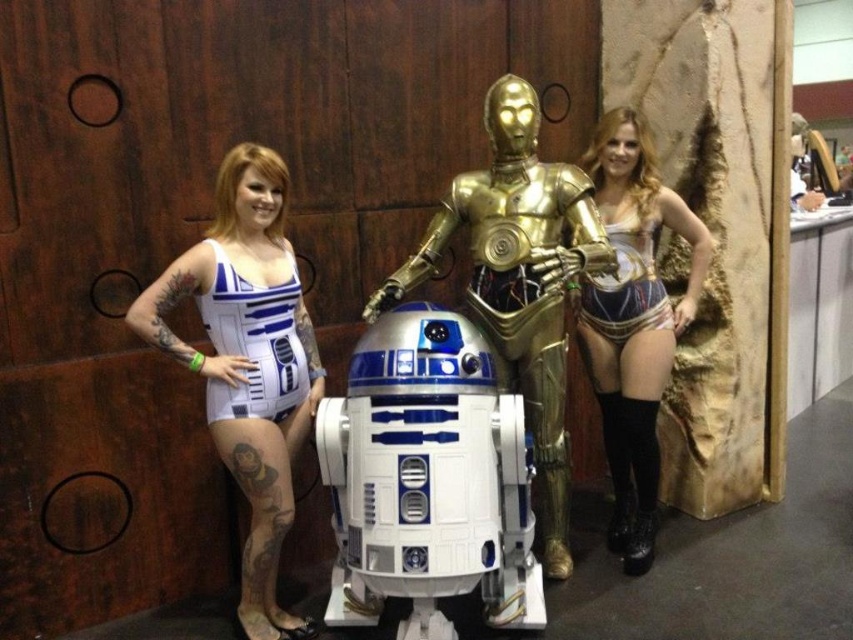
Question: Considering the real-world distances, which object is farthest from the matte gold bikini at center?

Choices:
 (A) white matte swimsuit at left
 (B) white matte bodysuit at left
 (C) metallic gold armor at center
 (D) gold metallic robot at center

Answer: (B)

Question: Does matte gold bikini at center come in front of metallic gold armor at center?

Choices:
 (A) no
 (B) yes

Answer: (B)

Question: Does gold metallic robot at center have a lesser width compared to white matte swimsuit at left?

Choices:
 (A) no
 (B) yes

Answer: (A)

Question: Which point is farther to the camera?

Choices:
 (A) matte gold bikini at center
 (B) metallic gold armor at center
 (C) white matte swimsuit at left

Answer: (B)

Question: Is the position of white matte bodysuit at left more distant than that of gold metallic robot at center?

Choices:
 (A) yes
 (B) no

Answer: (B)

Question: Which is nearer to the metallic gold armor at center?

Choices:
 (A) matte gold bikini at center
 (B) white matte swimsuit at left
 (C) gold metallic robot at center
 (D) white matte bodysuit at left

Answer: (A)